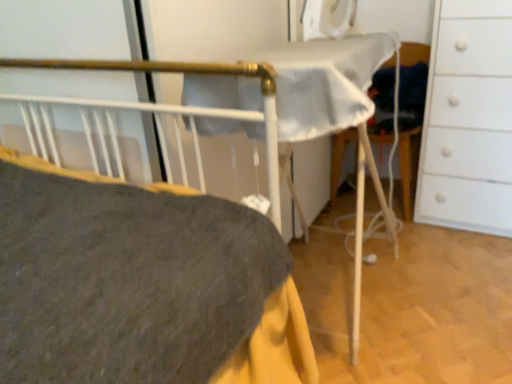
Question: Does point tap(453, 97) appear closer or farther from the camera than point tap(415, 183)?

Choices:
 (A) closer
 (B) farther

Answer: (A)

Question: Is white matte chest of drawers at right to the left or to the right of white fabric folding chair at center in the image?

Choices:
 (A) right
 (B) left

Answer: (A)

Question: Is white matte chest of drawers at right in front of or behind white fabric folding chair at center in the image?

Choices:
 (A) behind
 (B) front

Answer: (B)

Question: Relative to white matte chest of drawers at right, is white fabric folding chair at center in front or behind?

Choices:
 (A) behind
 (B) front

Answer: (A)

Question: Considering the relative positions of white fabric folding chair at center and white matte chest of drawers at right in the image provided, is white fabric folding chair at center to the left or to the right of white matte chest of drawers at right?

Choices:
 (A) left
 (B) right

Answer: (A)

Question: Is point (410, 180) positioned closer to the camera than point (490, 44)?

Choices:
 (A) closer
 (B) farther

Answer: (B)

Question: Based on their sizes in the image, would you say white fabric folding chair at center is bigger or smaller than white matte chest of drawers at right?

Choices:
 (A) big
 (B) small

Answer: (B)